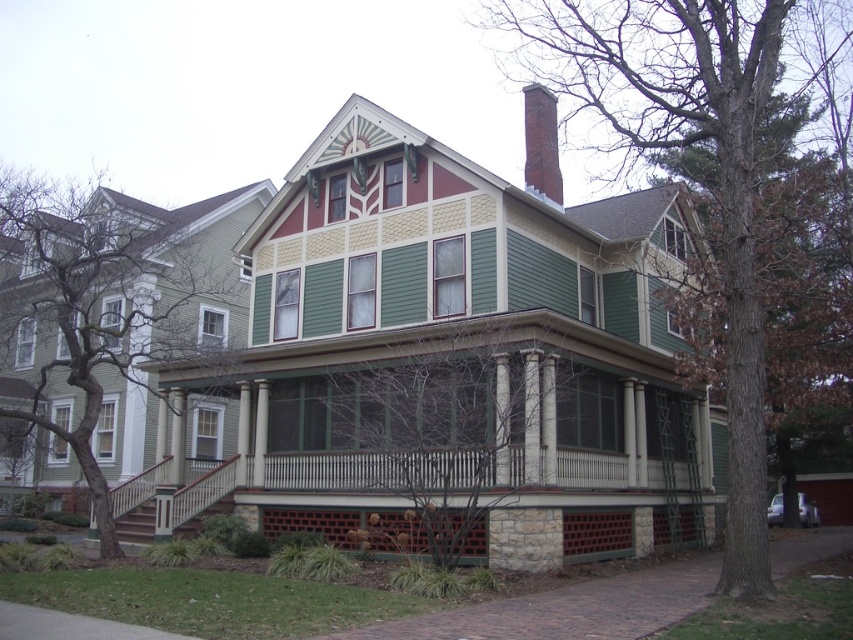
Between point (421, 524) and point (547, 195), which one is positioned in front?

Positioned in front is point (421, 524).

The width and height of the screenshot is (853, 640). I want to click on stone textured porch at lower center, so click(x=457, y=502).

What do you see at coordinates (457, 502) in the screenshot? Image resolution: width=853 pixels, height=640 pixels. I see `stone textured porch at lower center` at bounding box center [457, 502].

This screenshot has width=853, height=640. I want to click on stone textured porch at lower center, so click(457, 502).